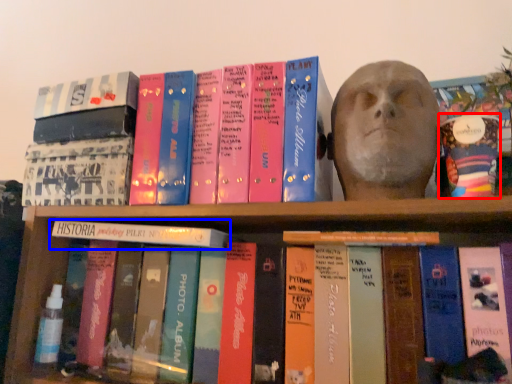
Question: Which of the following is the farthest to the observer, paperback book (highlighted by a red box) or book (highlighted by a blue box)?

Choices:
 (A) paperback book
 (B) book

Answer: (B)